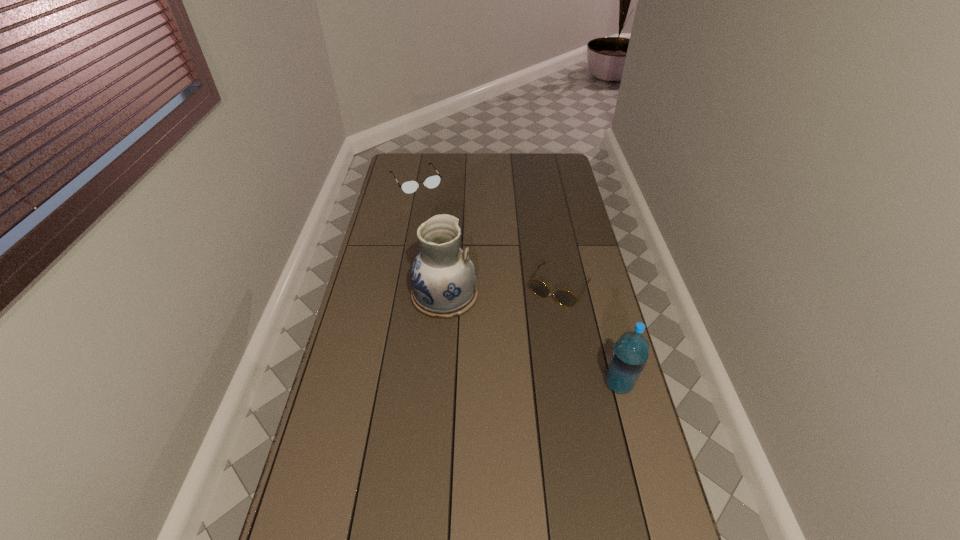
Locate an element on the screen. Image resolution: width=960 pixels, height=540 pixels. vacant space that's between the sunglasses and the second tallest object is located at coordinates (589, 335).

Identify which object is the nearest to the spectacles. Please provide its 2D coordinates. Your answer should be formatted as a tuple, i.e. [(x, y)], where the tuple contains the x and y coordinates of a point satisfying the conditions above.

[(443, 278)]

This screenshot has height=540, width=960. I want to click on object that can be found as the second closest to the water bottle, so click(x=443, y=278).

Where is `free space that satisfies the following two spatial constraints: 1. on the front side of the nearest object; 2. on the left side of the pottery`? The width and height of the screenshot is (960, 540). free space that satisfies the following two spatial constraints: 1. on the front side of the nearest object; 2. on the left side of the pottery is located at coordinates (438, 384).

Where is `vacant area that satisfies the following two spatial constraints: 1. on the front side of the sunglasses; 2. on the right side of the spectacles`? Image resolution: width=960 pixels, height=540 pixels. vacant area that satisfies the following two spatial constraints: 1. on the front side of the sunglasses; 2. on the right side of the spectacles is located at coordinates (396, 287).

The image size is (960, 540). What are the coordinates of `vacant space that satisfies the following two spatial constraints: 1. on the back side of the sunglasses; 2. on the left side of the pottery` in the screenshot? It's located at (445, 287).

Image resolution: width=960 pixels, height=540 pixels. I want to click on free space that satisfies the following two spatial constraints: 1. on the back side of the sunglasses; 2. on the left side of the pottery, so click(x=445, y=287).

You are a GUI agent. You are given a task and a screenshot of the screen. Output one action in this format:
    pyautogui.click(x=<x>, y=<y>)
    Task: Click on the free space that satisfies the following two spatial constraints: 1. on the front side of the sunglasses; 2. on the right side of the farthest object
    This screenshot has height=540, width=960.
    Given the screenshot: What is the action you would take?
    pyautogui.click(x=396, y=287)